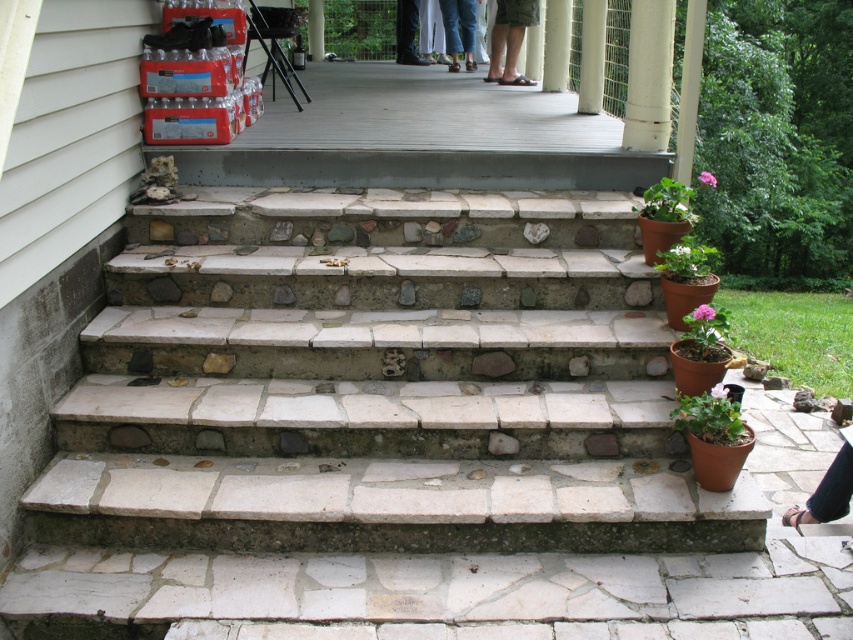
Question: Which object is positioned farthest from the white smooth pipe at upper center?

Choices:
 (A) brown leather sandals at center
 (B) white painted wood pillar at upper center
 (C) blue jeans at upper center

Answer: (B)

Question: Which of the following is the closest to the observer?

Choices:
 (A) blue jeans at upper center
 (B) white stone pillar at center

Answer: (B)

Question: Does green matte pot at right appear over white painted wood pillar at upper center?

Choices:
 (A) no
 (B) yes

Answer: (A)

Question: Which object is positioned closest to the black leather sandals at lower right?

Choices:
 (A) white stone pillar at upper center
 (B) white painted wood pillar at upper center

Answer: (A)

Question: Is natural stone stairs at center below wooden deck at upper center?

Choices:
 (A) yes
 (B) no

Answer: (A)

Question: Does white smooth pipe at upper center appear on the right side of green matte pot at right?

Choices:
 (A) yes
 (B) no

Answer: (B)